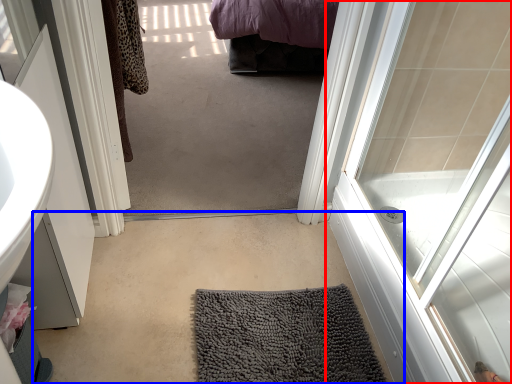
Question: Which object appears closest to the camera in this image, door (highlighted by a red box) or plain (highlighted by a blue box)?

Choices:
 (A) door
 (B) plain

Answer: (A)